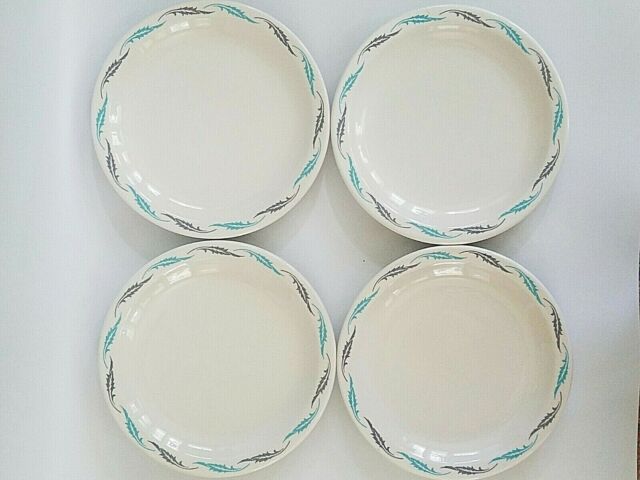
Where is `plate`? The width and height of the screenshot is (640, 480). plate is located at coordinates (443, 140), (265, 104), (232, 344), (450, 363).